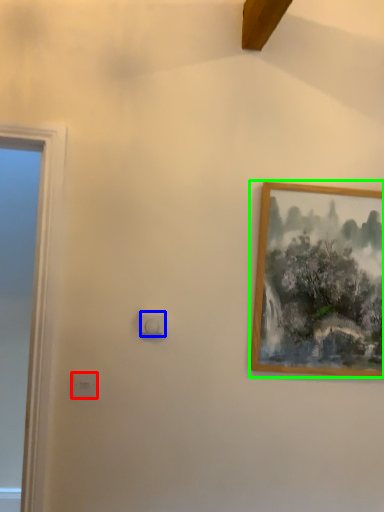
Question: Based on their relative distances, which object is nearer to light switch (highlighted by a red box)? Choose from light switch (highlighted by a blue box) and picture frame (highlighted by a green box).

Choices:
 (A) light switch
 (B) picture frame

Answer: (A)